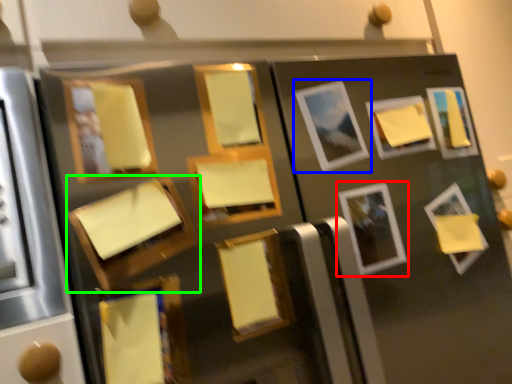
Question: Considering the real-world distances, which object is farthest from picture frame (highlighted by a red box)? picture frame (highlighted by a blue box) or picture frame (highlighted by a green box)?

Choices:
 (A) picture frame
 (B) picture frame

Answer: (B)